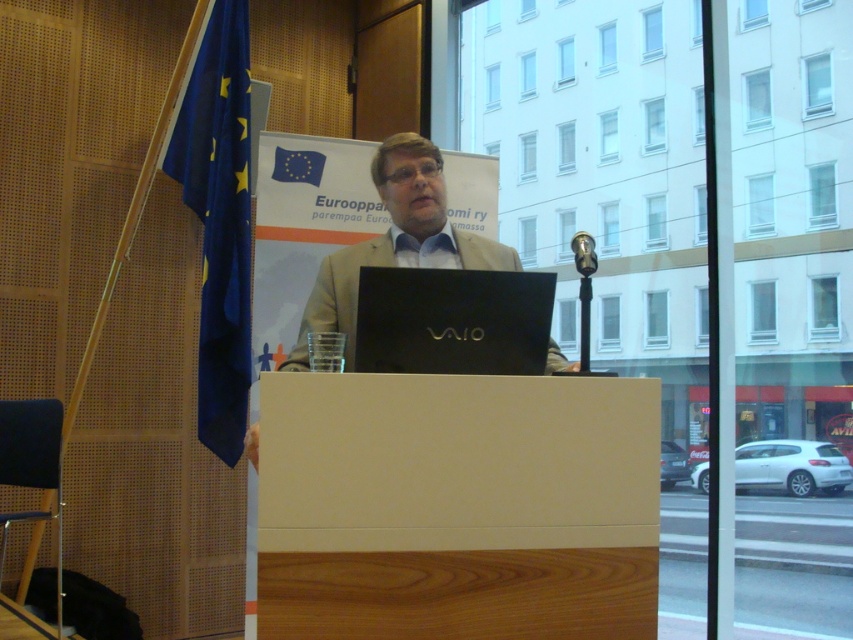
Is black matte laptop at center further to the viewer compared to metallic at right?

No, it is in front of metallic at right.

Can you confirm if black matte laptop at center is wider than metallic at right?

Yes, black matte laptop at center is wider than metallic at right.

What do you see at coordinates (454, 321) in the screenshot? Image resolution: width=853 pixels, height=640 pixels. I see `black matte laptop at center` at bounding box center [454, 321].

This screenshot has height=640, width=853. Find the location of `black matte laptop at center`. black matte laptop at center is located at coordinates (454, 321).

Who is more forward, (x=281, y=368) or (x=578, y=244)?

Point (x=578, y=244) is more forward.

Does point (426, 268) come farther from viewer compared to point (595, 257)?

Yes.

The image size is (853, 640). Find the location of `matte black laptop at center`. matte black laptop at center is located at coordinates (395, 241).

Does blue fabric flag at left have a smaller size compared to metallic at right?

Actually, blue fabric flag at left might be larger than metallic at right.

Between point (209, 28) and point (579, 257), which one is positioned in front?

Positioned in front is point (579, 257).

Image resolution: width=853 pixels, height=640 pixels. I want to click on blue fabric flag at left, so click(x=219, y=218).